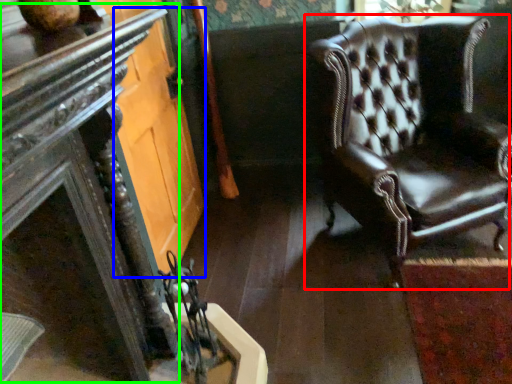
Question: Which is farther away from chair (highlighted by a red box)? glass door (highlighted by a blue box) or table (highlighted by a green box)?

Choices:
 (A) glass door
 (B) table

Answer: (B)